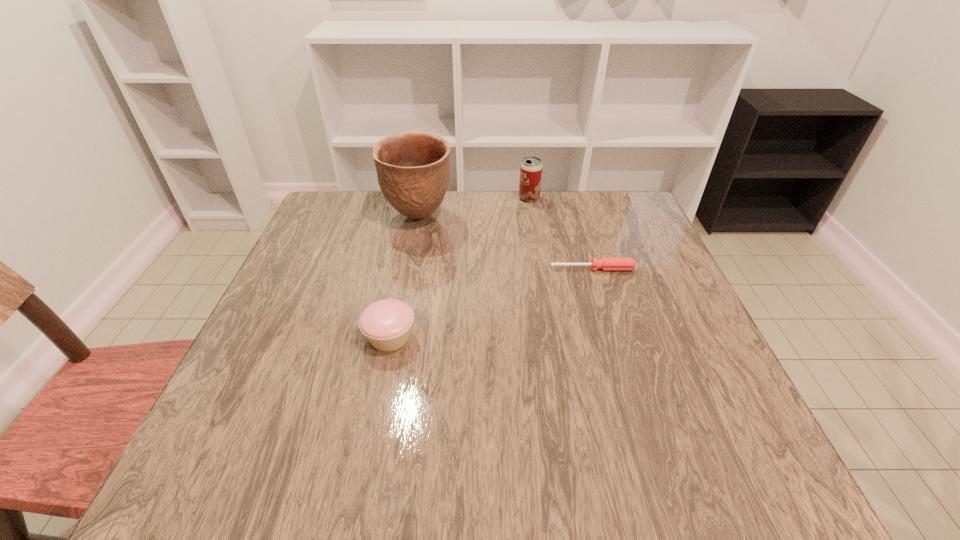
At what (x,y) coordinates should I click in order to perform the action: click on vacant region between the third shortest object and the tallest object. Please return your answer as a coordinate pair (x, y). The width and height of the screenshot is (960, 540). Looking at the image, I should click on (474, 207).

Identify the location of free spot between the third tallest object and the tallest object. This screenshot has width=960, height=540. (404, 277).

Locate an element on the screen. free space that is in between the shortest object and the second shortest object is located at coordinates (492, 303).

The image size is (960, 540). What are the coordinates of `free point between the shortest object and the cupcake` in the screenshot? It's located at (492, 303).

The height and width of the screenshot is (540, 960). In order to click on empty location between the pottery and the shortest object in this screenshot , I will do `click(506, 242)`.

Locate an element on the screen. The width and height of the screenshot is (960, 540). vacant area between the beer can and the nearest object is located at coordinates coord(460,267).

I want to click on free space between the third tallest object and the beer can, so click(x=460, y=267).

Identify the location of unoccupied position between the tallest object and the beer can. The height and width of the screenshot is (540, 960). tap(474, 207).

At what (x,y) coordinates should I click in order to perform the action: click on free space that is in between the cupcake and the shortest object. Please return your answer as a coordinate pair (x, y). This screenshot has height=540, width=960. Looking at the image, I should click on (492, 303).

Find the location of a particular element. This screenshot has width=960, height=540. object that is the closest to the second tallest object is located at coordinates (413, 168).